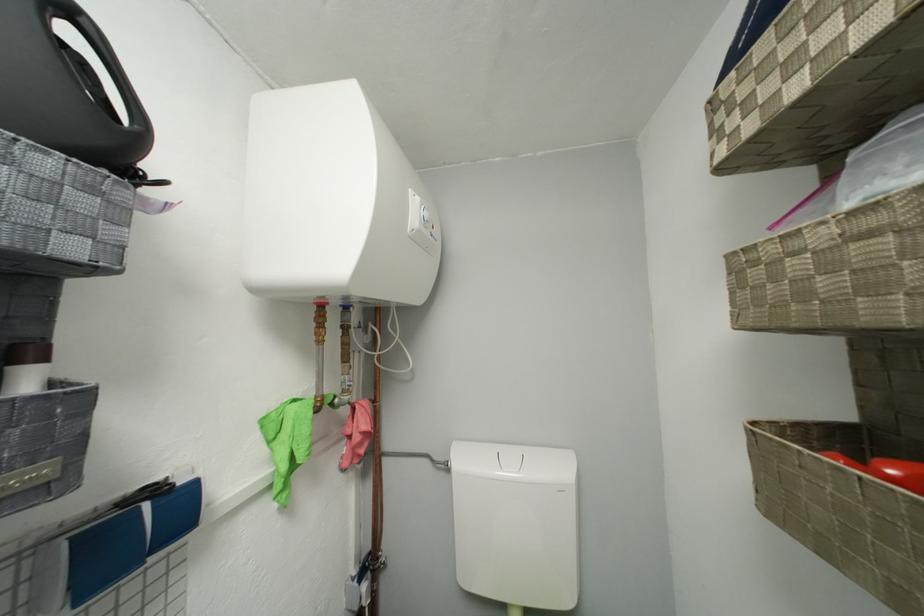
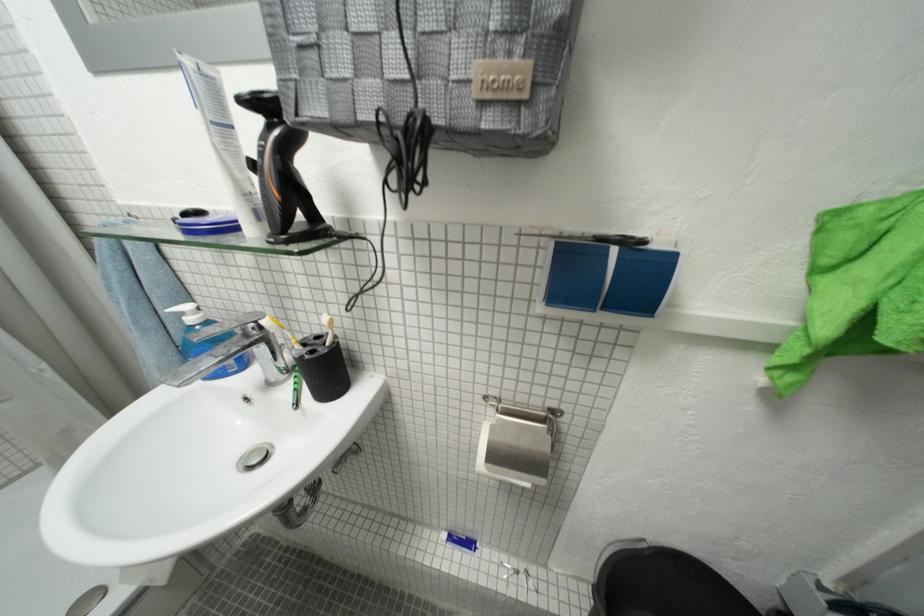
Based on the continuous images, in which direction is the camera rotating?

The camera's rotation is toward left-down.